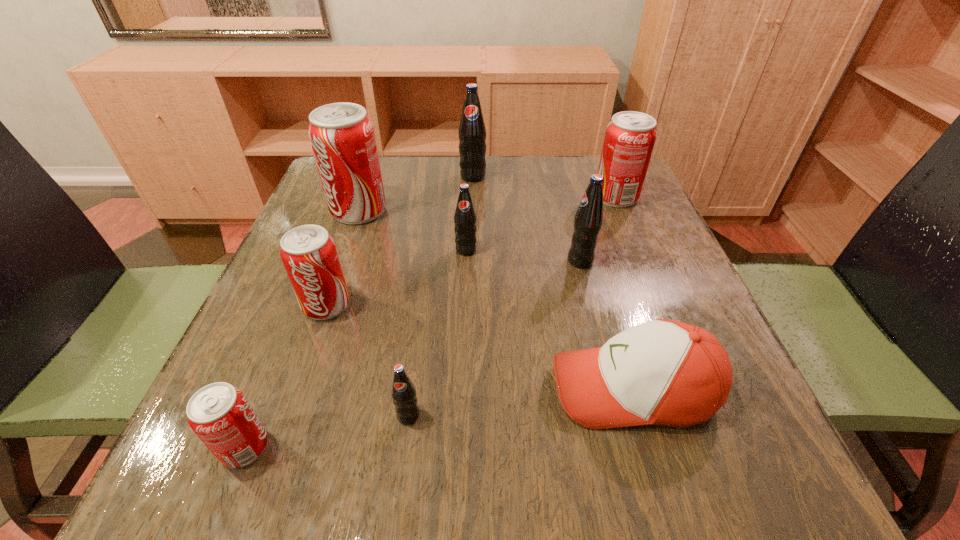
You are a GUI agent. You are given a task and a screenshot of the screen. Output one action in this format:
    pyautogui.click(x=<x>, y=<y>)
    Task: Click on the soda can that can be found as the fifth closest to the baseball cap
    The width and height of the screenshot is (960, 540).
    Given the screenshot: What is the action you would take?
    pyautogui.click(x=220, y=415)

Where is `black pop that can be found as the third closest to the rightmost black pop`? black pop that can be found as the third closest to the rightmost black pop is located at coordinates click(403, 392).

At what (x,y) coordinates should I click in order to perform the action: click on the third closest black pop to the leftmost black pop. Please return your answer as a coordinate pair (x, y). This screenshot has height=540, width=960. Looking at the image, I should click on (472, 132).

Locate which red soda can ranks second in proximity to the biggest red soda can. Please provide its 2D coordinates. Your answer should be formatted as a tuple, i.e. [(x, y)], where the tuple contains the x and y coordinates of a point satisfying the conditions above.

[(220, 415)]

Identify which red soda can is located as the second nearest to the leftmost black pop. Please provide its 2D coordinates. Your answer should be formatted as a tuple, i.e. [(x, y)], where the tuple contains the x and y coordinates of a point satisfying the conditions above.

[(309, 255)]

Image resolution: width=960 pixels, height=540 pixels. Find the location of `free space that satisfies the following two spatial constraints: 1. on the front label of the rightmost black pop; 2. on the front label of the leftmost black pop`. free space that satisfies the following two spatial constraints: 1. on the front label of the rightmost black pop; 2. on the front label of the leftmost black pop is located at coordinates (620, 416).

Locate an element on the screen. This screenshot has height=540, width=960. free spot that satisfies the following two spatial constraints: 1. on the front label of the second soda can from right to left; 2. on the front label of the fifth soda can from right to left is located at coordinates (620, 416).